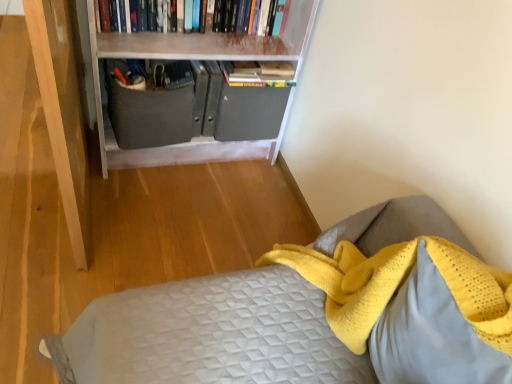
Question: In the image, is hardcover books at upper center on the left side or the right side of white matte bookcase at upper center?

Choices:
 (A) left
 (B) right

Answer: (B)

Question: Is hardcover books at upper center wider or thinner than white matte bookcase at upper center?

Choices:
 (A) thin
 (B) wide

Answer: (A)

Question: Which object is the farthest from the yellow knitted pillow at lower right?

Choices:
 (A) hardcover books at upper center
 (B) matte gray drawer at center
 (C) white matte bookcase at upper center

Answer: (A)

Question: Which object is the closest to the hardcover books at upper center?

Choices:
 (A) white matte bookcase at upper center
 (B) matte gray drawer at center
 (C) yellow knitted pillow at lower right

Answer: (A)